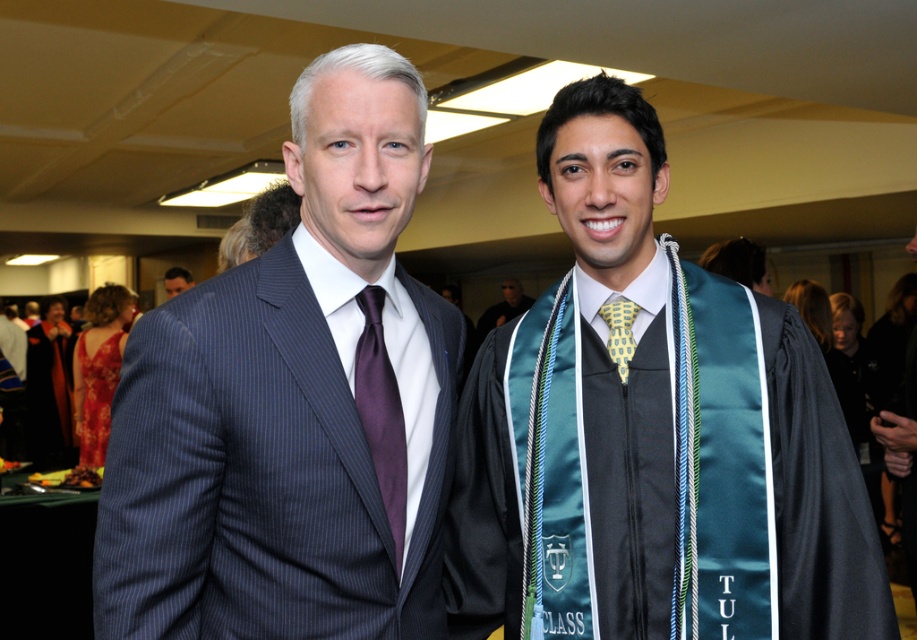
Please generate a spatial reasoning question and answer based on the provided information. Make sure to follow all the rules outlined above. The question must be in English and the answer must be concise and factual. The question should ask about the position of the teal satin sash at center in relation to the other objects in the scene. The answer should use the coordinates provided in the Objects Description to determine its position. Remember not to mention the coordinates in the question, only in the ,

The teal satin sash at center is positioned at coordinates (x=650, y=435), which places it near the lower right area of the image. Since the man on the right is wearing the graduation gown with the sash, the sash is located on his gown, likely over his left shoulder.

You are a photographer at a graduation ceremony. You need to ensure that both the teal satin sash at center and the blue fabric tie at left are clearly visible in the photo. Given their sizes, which one might require more careful framing to avoid being overshadowed?

The blue fabric tie at left is smaller in size compared to the teal satin sash at center, so it might require more careful framing to ensure it is clearly visible and not overshadowed by the larger sash.

In the scene shown: You are a photographer at a graduation ceremony. You need to take a photo that includes both the teal satin sash at center and the shiny red dress at left. The camera has a maximum focus range of 4 meters. Will both items be in focus?

The teal satin sash at center and shiny red dress at left are 4.14 meters apart from each other. Since the distance exceeds the camera maximum focus range of 4 meters, the two items will not be in focus simultaneously.